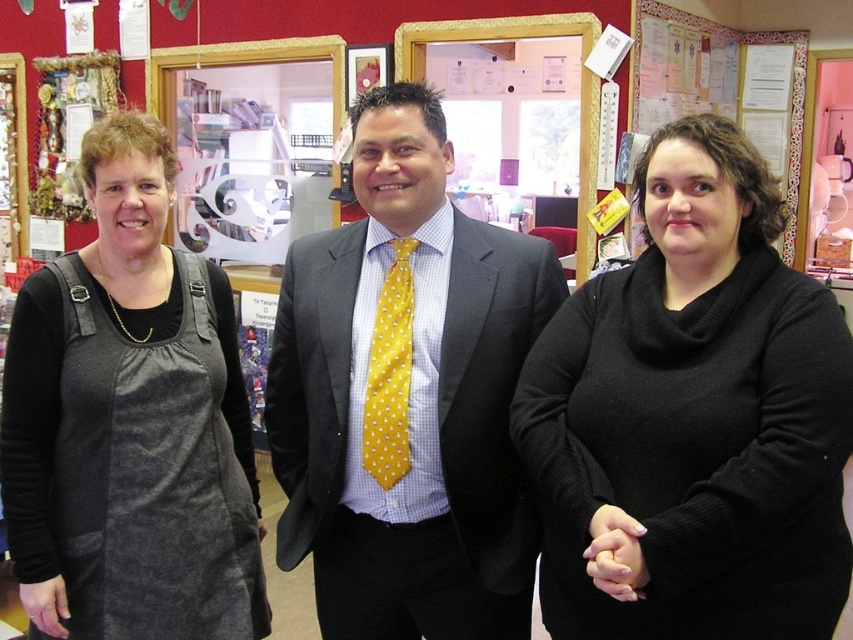
Does dark gray fabric apron at left have a greater width compared to white paperboard at upper right?

Incorrect, dark gray fabric apron at left's width does not surpass white paperboard at upper right's.

Can you confirm if dark gray fabric apron at left is positioned below white paperboard at upper right?

Yes.

Who is more distant from viewer, (239, 372) or (788, 115)?

The point (788, 115) is more distant.

At what (x,y) coordinates should I click in order to perform the action: click on dark gray fabric apron at left. Please return your answer as a coordinate pair (x, y). Image resolution: width=853 pixels, height=640 pixels. Looking at the image, I should click on (131, 426).

Based on the photo, between black wool sweater at center and yellow dotted fabric tie at center, which one is positioned higher?

yellow dotted fabric tie at center is higher up.

What do you see at coordinates (692, 419) in the screenshot? I see `black wool sweater at center` at bounding box center [692, 419].

This screenshot has width=853, height=640. I want to click on black wool sweater at center, so click(x=692, y=419).

Is yellow dotted fabric tie at center shorter than white paperboard at upper right?

Indeed, yellow dotted fabric tie at center has a lesser height compared to white paperboard at upper right.

Does yellow dotted fabric tie at center appear under white paperboard at upper right?

Correct, yellow dotted fabric tie at center is located below white paperboard at upper right.

Between point (408, 273) and point (699, 19), which one is positioned behind?

Positioned behind is point (699, 19).

The width and height of the screenshot is (853, 640). What are the coordinates of `yellow dotted fabric tie at center` in the screenshot? It's located at (389, 372).